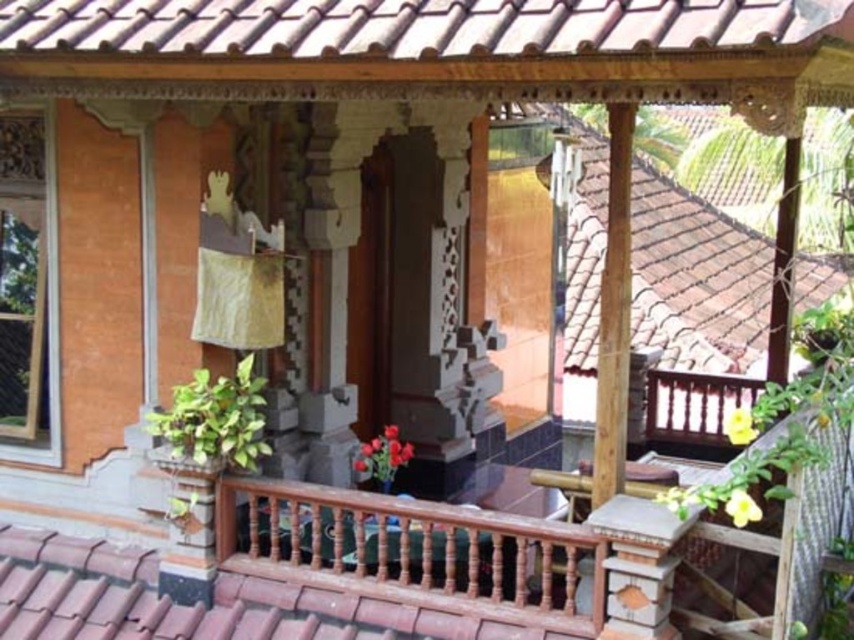
You are an architect examining the Balinese house. You need to determine the spatial relationship between the brown clay tiles at upper center and the brown tile roof at upper right. Which one is positioned higher in the image?

The brown clay tiles at upper center is positioned higher than the brown tile roof at upper right.

You are standing in front of the traditional Balinese house and want to take a photo of both the brown wooden balustrade at center and the brown tile roof at upper right. Which object should you frame first in your camera viewfinder to ensure both are visible in the photo?

The brown wooden balustrade at center should be framed first since it is positioned to the left of the brown tile roof at upper right, allowing both objects to be captured in the same frame.